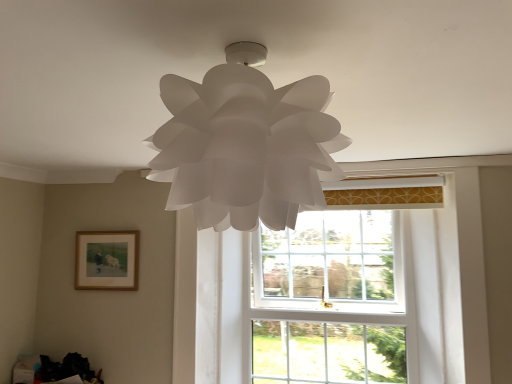
Question: Is white paper lamp at center not close to wooden framed painting at lower left?

Choices:
 (A) yes
 (B) no

Answer: (A)

Question: Could wooden framed painting at lower left be considered to be inside white paper lamp at center?

Choices:
 (A) yes
 (B) no

Answer: (B)

Question: Could you tell me if white paper lamp at center is turned towards wooden framed painting at lower left?

Choices:
 (A) yes
 (B) no

Answer: (B)

Question: Can you confirm if white paper lamp at center is smaller than wooden framed painting at lower left?

Choices:
 (A) yes
 (B) no

Answer: (B)

Question: Can you confirm if white paper lamp at center is wider than wooden framed painting at lower left?

Choices:
 (A) no
 (B) yes

Answer: (B)

Question: Is wooden framed painting at lower left wider or thinner than white glass window at center?

Choices:
 (A) thin
 (B) wide

Answer: (A)

Question: From a real-world perspective, relative to white glass window at center, is wooden framed painting at lower left vertically above or below?

Choices:
 (A) above
 (B) below

Answer: (A)

Question: Considering the relative positions of wooden framed painting at lower left and white glass window at center in the image provided, is wooden framed painting at lower left to the left or to the right of white glass window at center?

Choices:
 (A) right
 (B) left

Answer: (B)

Question: Is wooden framed painting at lower left in front of or behind white glass window at center in the image?

Choices:
 (A) behind
 (B) front

Answer: (A)

Question: Is point (258, 198) positioned closer to the camera than point (247, 256)?

Choices:
 (A) closer
 (B) farther

Answer: (A)

Question: Considering the positions of white paper lamp at center and white glass window at center in the image, is white paper lamp at center wider or thinner than white glass window at center?

Choices:
 (A) thin
 (B) wide

Answer: (B)

Question: From the image's perspective, is white paper lamp at center located above or below white glass window at center?

Choices:
 (A) below
 (B) above

Answer: (B)

Question: Is white paper lamp at center taller or shorter than white glass window at center?

Choices:
 (A) short
 (B) tall

Answer: (A)

Question: Looking at their shapes, would you say white glass window at center is wider or thinner than white paper lamp at center?

Choices:
 (A) thin
 (B) wide

Answer: (A)

Question: From their relative heights in the image, would you say white glass window at center is taller or shorter than white paper lamp at center?

Choices:
 (A) tall
 (B) short

Answer: (A)